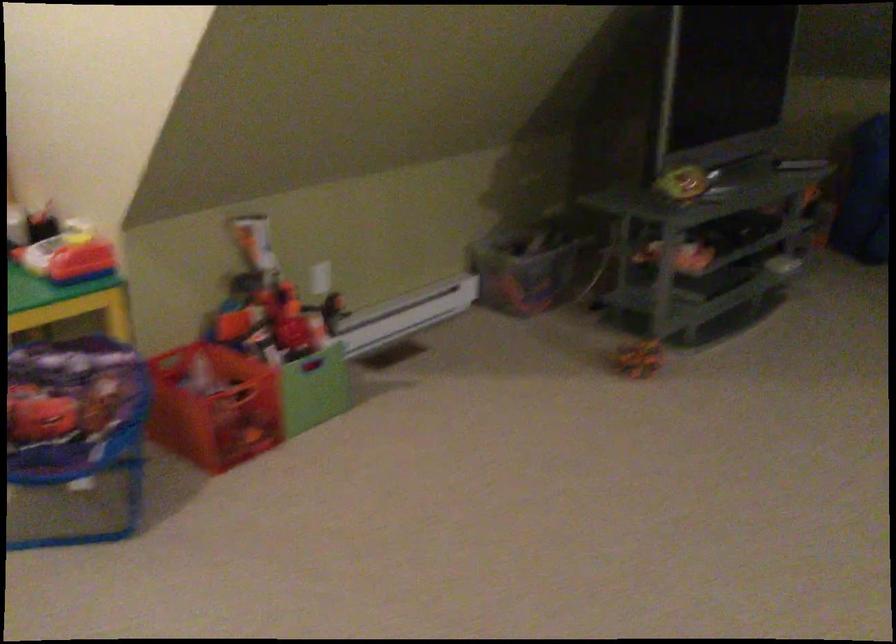
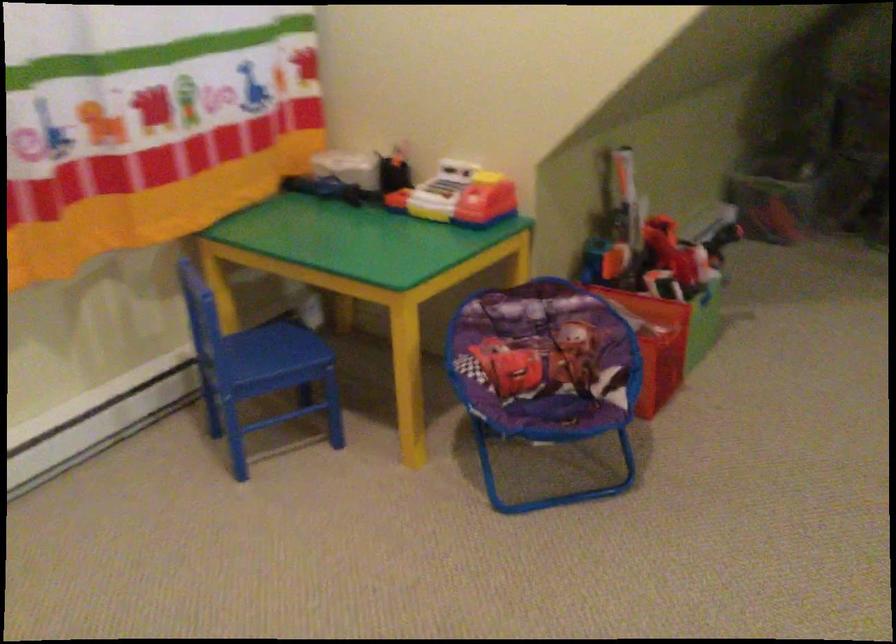
In the second image, find the point that corresponds to point (200, 406) in the first image.

(653, 343)